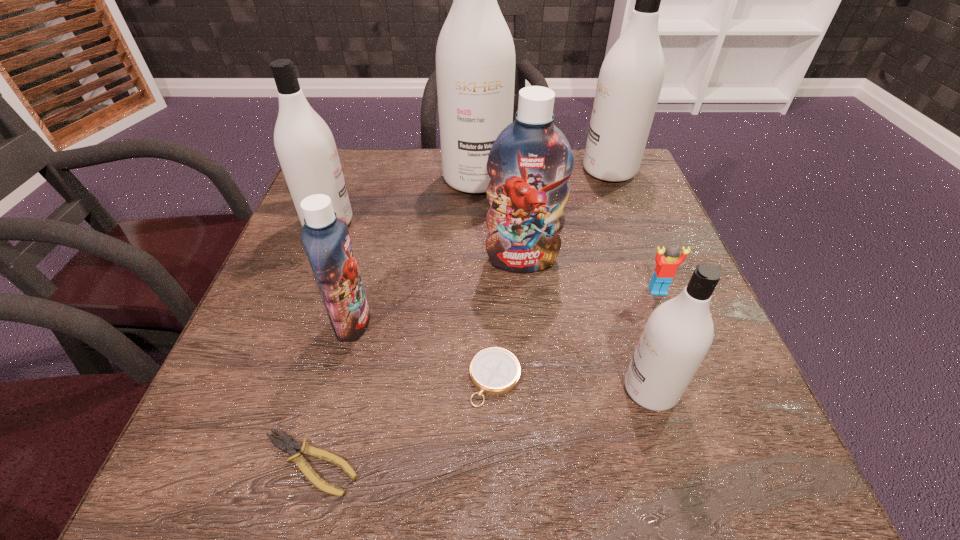
Locate an element on the screen. object at the near edge is located at coordinates (290, 445).

Where is `pliers present at the left edge`? pliers present at the left edge is located at coordinates (290, 445).

The height and width of the screenshot is (540, 960). What are the coordinates of `Lego that is positioned at the right edge` in the screenshot? It's located at tap(665, 270).

I want to click on object that is at the near left corner, so click(290, 445).

The width and height of the screenshot is (960, 540). What are the coordinates of `object that is at the far right corner` in the screenshot? It's located at (630, 79).

Locate an element on the screen. The image size is (960, 540). vacant position at the far edge of the desktop is located at coordinates (447, 197).

The height and width of the screenshot is (540, 960). What are the coordinates of `free point at the near edge` in the screenshot? It's located at (359, 444).

Locate an element on the screen. The width and height of the screenshot is (960, 540). free region at the left edge of the desktop is located at coordinates (316, 360).

You are a GUI agent. You are given a task and a screenshot of the screen. Output one action in this format:
    pyautogui.click(x=<x>, y=<y>)
    Task: Click on the vacant position at the right edge of the desktop
    
    Given the screenshot: What is the action you would take?
    pyautogui.click(x=635, y=256)

At what (x,y) coordinates should I click in order to perform the action: click on free space at the near right corner of the desktop. Please return your answer as a coordinate pair (x, y). Looking at the image, I should click on (782, 476).